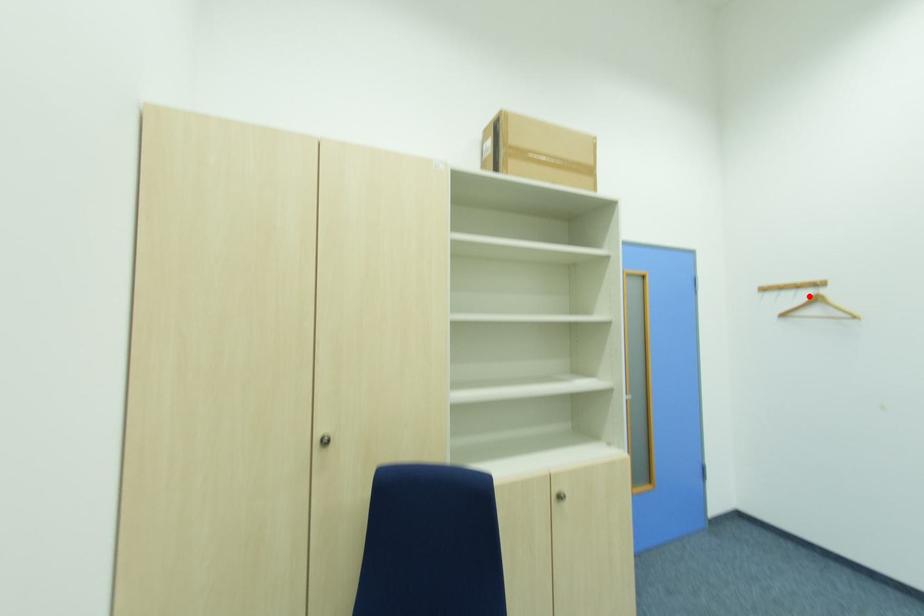
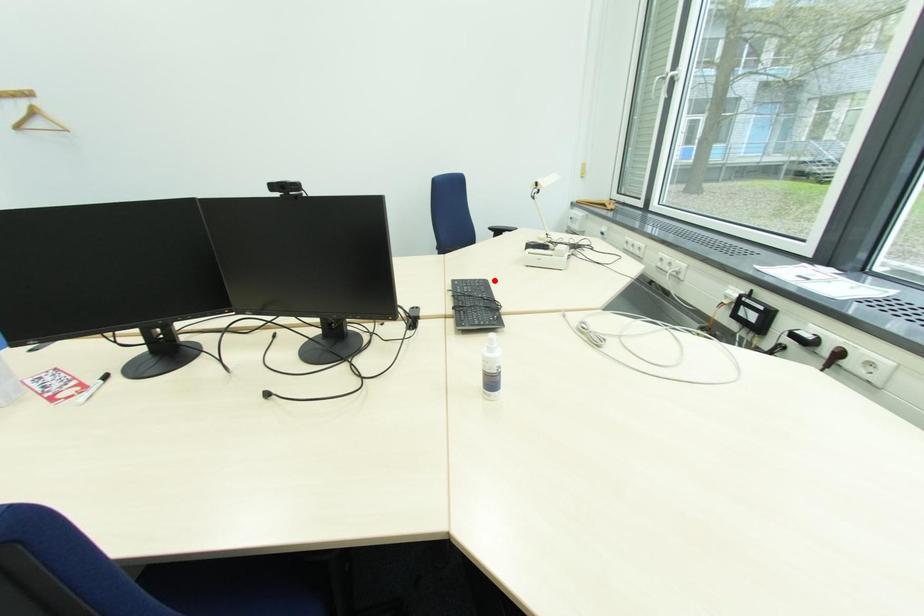
I am providing you with two images of the same scene from different viewpoints. A red point is marked on the first image and another point is marked on the second image. Does the point marked in image1 correspond to the same location as the one in image2?

No